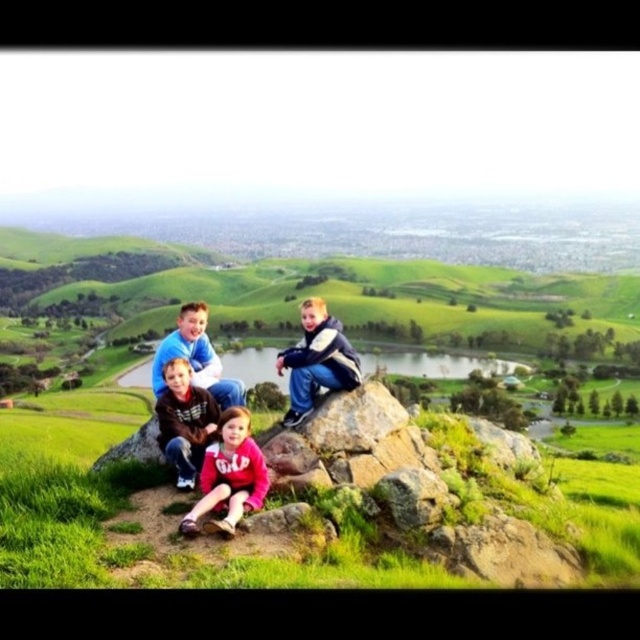
Question: Is matte pink hoodie at lower center further to camera compared to green grassy lake at center?

Choices:
 (A) yes
 (B) no

Answer: (B)

Question: Which is nearer to the brown fuzzy sweater at center?

Choices:
 (A) smooth gray rock at center
 (B) blue fleece jacket at center

Answer: (B)

Question: Is blue denim jeans at center further to the viewer compared to smooth gray rock at center?

Choices:
 (A) no
 (B) yes

Answer: (B)

Question: Considering the relative positions of matte pink hoodie at lower center and brown fuzzy sweater at center in the image provided, where is matte pink hoodie at lower center located with respect to brown fuzzy sweater at center?

Choices:
 (A) above
 (B) below

Answer: (B)

Question: Which of the following is the closest to the observer?

Choices:
 (A) blue denim jeans at center
 (B) brown fuzzy sweater at center

Answer: (B)

Question: Among these objects, which one is nearest to the camera?

Choices:
 (A) green grassy lake at center
 (B) matte pink hoodie at lower center
 (C) blue denim jeans at center
 (D) blue fleece jacket at center

Answer: (B)